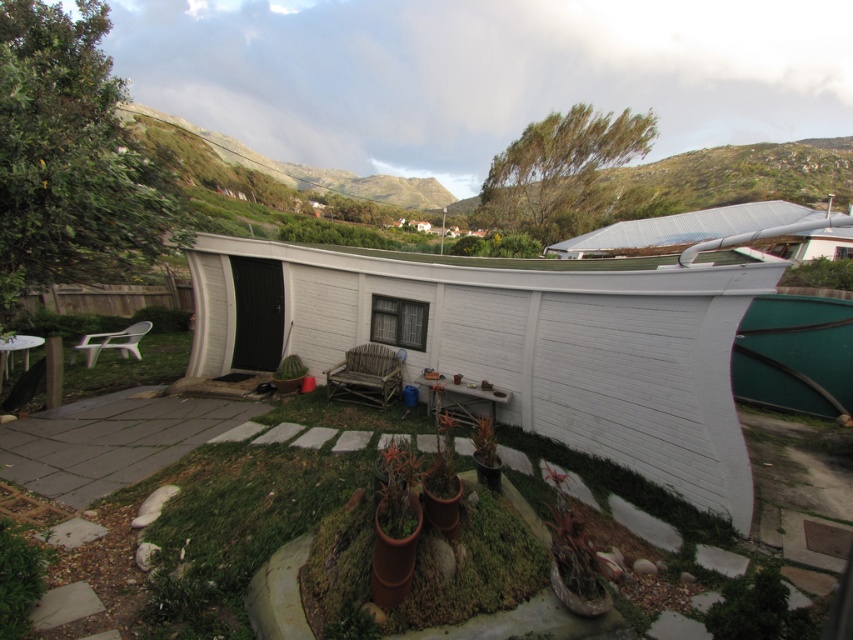
Who is positioned more to the right, white wood hut at center or white plastic chair at lower left?

white wood hut at center

The width and height of the screenshot is (853, 640). Describe the element at coordinates (514, 340) in the screenshot. I see `white wood hut at center` at that location.

The width and height of the screenshot is (853, 640). What are the coordinates of `white wood hut at center` in the screenshot? It's located at (514, 340).

From the picture: Does green grassy hillside at upper center appear under white plastic chair at lower left?

Actually, green grassy hillside at upper center is above white plastic chair at lower left.

Between point (788, 145) and point (88, 352), which one is positioned in front?

Positioned in front is point (88, 352).

This screenshot has width=853, height=640. In order to click on green grassy hillside at upper center in this screenshot , I will do `click(746, 173)`.

Is green grassy hillside at upper center positioned behind metallic silver hut at upper right?

Yes.

Where is `green grassy hillside at upper center`? The width and height of the screenshot is (853, 640). green grassy hillside at upper center is located at coordinates click(746, 173).